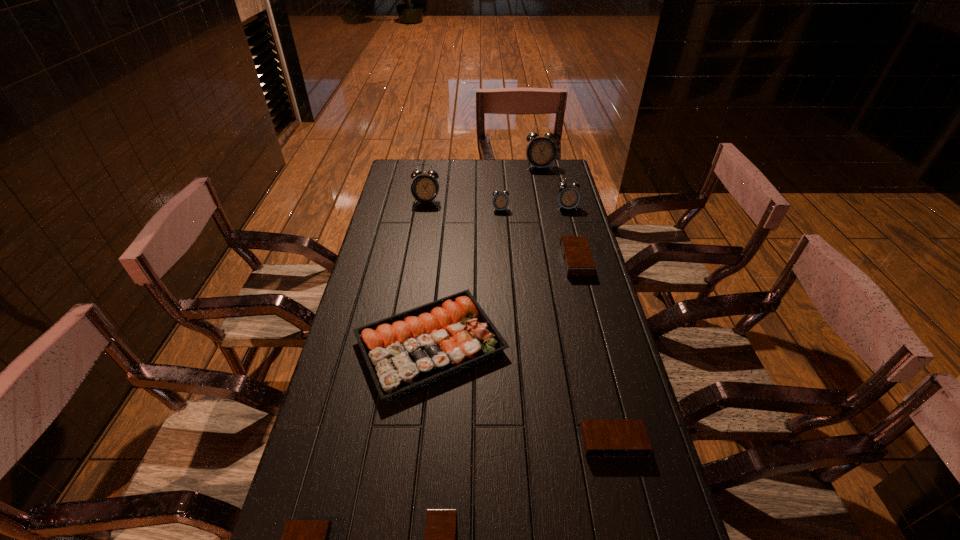
You are a GUI agent. You are given a task and a screenshot of the screen. Output one action in this format:
    pyautogui.click(x=<x>, y=<y>)
    Task: Click on the biggest white alarm clock
    The width and height of the screenshot is (960, 540).
    Given the screenshot: What is the action you would take?
    pyautogui.click(x=540, y=152)

Where is `the tallest object`? The width and height of the screenshot is (960, 540). the tallest object is located at coordinates (540, 152).

I want to click on the seventh alarm clock from right to left, so click(425, 187).

Where is `the second tallest object`? This screenshot has height=540, width=960. the second tallest object is located at coordinates (425, 187).

This screenshot has height=540, width=960. In order to click on the sixth shortest alarm clock in this screenshot , I will do `click(568, 197)`.

Where is `the third tallest object`? The width and height of the screenshot is (960, 540). the third tallest object is located at coordinates (568, 197).

Locate an element on the screen. Image resolution: width=960 pixels, height=540 pixels. the fourth tallest object is located at coordinates (500, 201).

You are a GUI agent. You are given a task and a screenshot of the screen. Output one action in this format:
    pyautogui.click(x=<x>, y=<y>)
    Task: Click on the fourth alarm clock from left to right
    The height and width of the screenshot is (540, 960).
    Given the screenshot: What is the action you would take?
    pyautogui.click(x=500, y=201)

The height and width of the screenshot is (540, 960). I want to click on platter, so click(x=410, y=350).

You are a GUI agent. You are given a task and a screenshot of the screen. Output one action in this format:
    pyautogui.click(x=<x>, y=<y>)
    Task: Click on the fourth nearest alarm clock
    
    Given the screenshot: What is the action you would take?
    pyautogui.click(x=578, y=262)